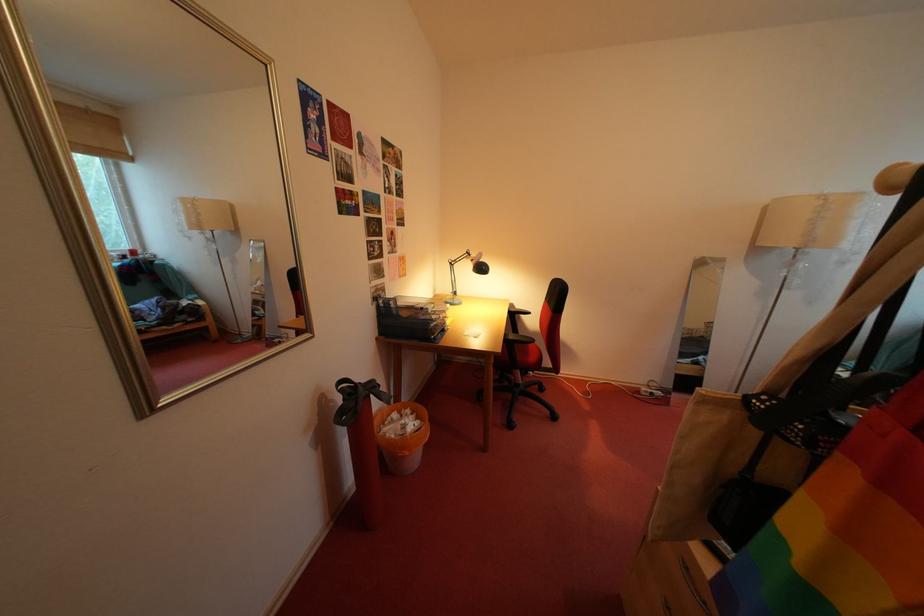
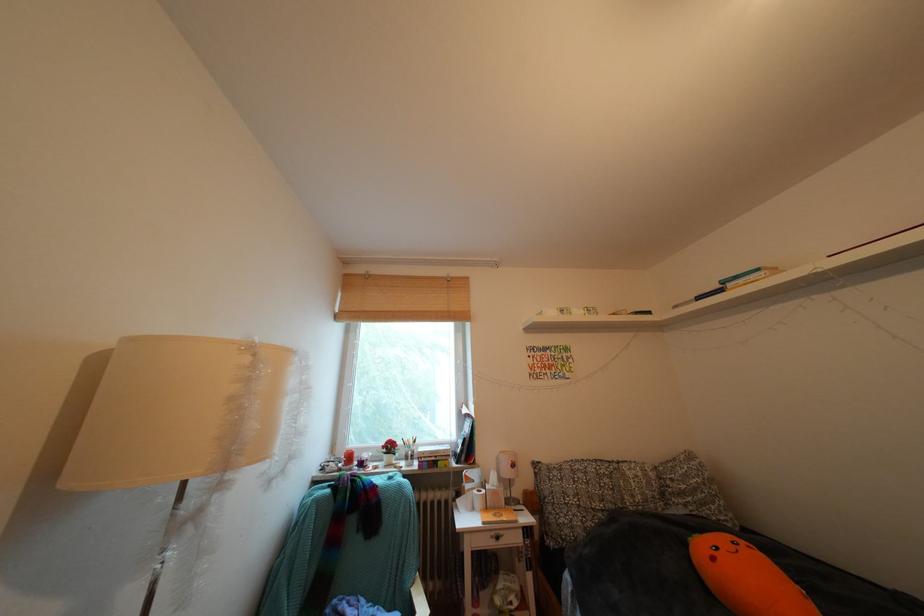
Find the pixel in the second image that matches pixel 833 201 in the first image.

(259, 353)